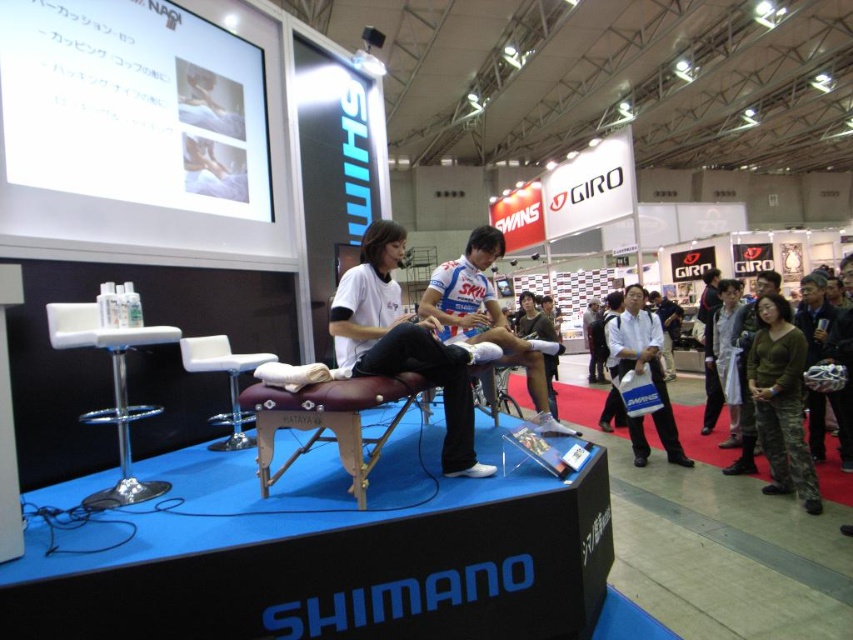
Does white fabric cycling jersey at center appear over white plastic stool at left?

Indeed, white fabric cycling jersey at center is positioned over white plastic stool at left.

Describe the element at coordinates (486, 316) in the screenshot. Image resolution: width=853 pixels, height=640 pixels. I see `white fabric cycling jersey at center` at that location.

Identify the location of white fabric cycling jersey at center. pyautogui.click(x=486, y=316).

Is white fabric cycling jersey at center below white leather stool at center?

No.

Does point (477, 228) come behind point (216, 355)?

Yes, point (477, 228) is behind point (216, 355).

Which is in front, point (491, 292) or point (186, 356)?

Point (186, 356) is more forward.

Find the location of a particular element. white fabric cycling jersey at center is located at coordinates (486, 316).

How distant is brown leather stool at center from white matte bag at center?

They are 3.36 meters apart.

In the scene shown: Does brown leather stool at center have a larger size compared to white matte bag at center?

Incorrect, brown leather stool at center is not larger than white matte bag at center.

Is point (376, 451) less distant than point (665, 385)?

Yes, it is in front of point (665, 385).

Identify the location of brown leather stool at center. This screenshot has height=640, width=853. (328, 420).